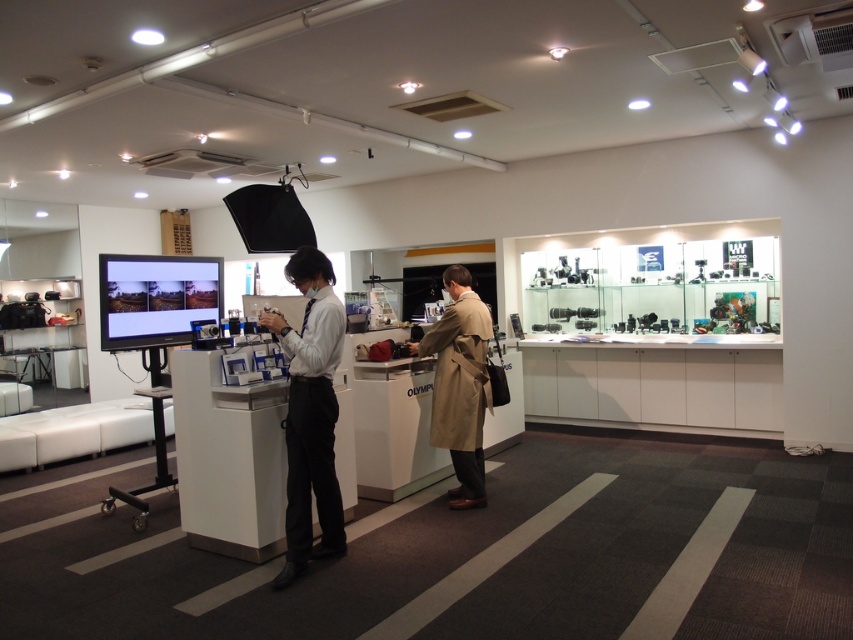
Question: Can you confirm if white shirt at center is thinner than tan leather trench coat at center?

Choices:
 (A) no
 (B) yes

Answer: (A)

Question: Which point is farther from the camera taking this photo?

Choices:
 (A) (477, 381)
 (B) (282, 573)

Answer: (A)

Question: Which point appears closest to the camera in this image?

Choices:
 (A) (445, 321)
 (B) (318, 326)

Answer: (B)

Question: Which point is closer to the camera?

Choices:
 (A) white shirt at center
 (B) tan leather trench coat at center

Answer: (A)

Question: Is white shirt at center to the left of tan leather trench coat at center from the viewer's perspective?

Choices:
 (A) no
 (B) yes

Answer: (B)

Question: Does white shirt at center appear on the right side of tan leather trench coat at center?

Choices:
 (A) yes
 (B) no

Answer: (B)